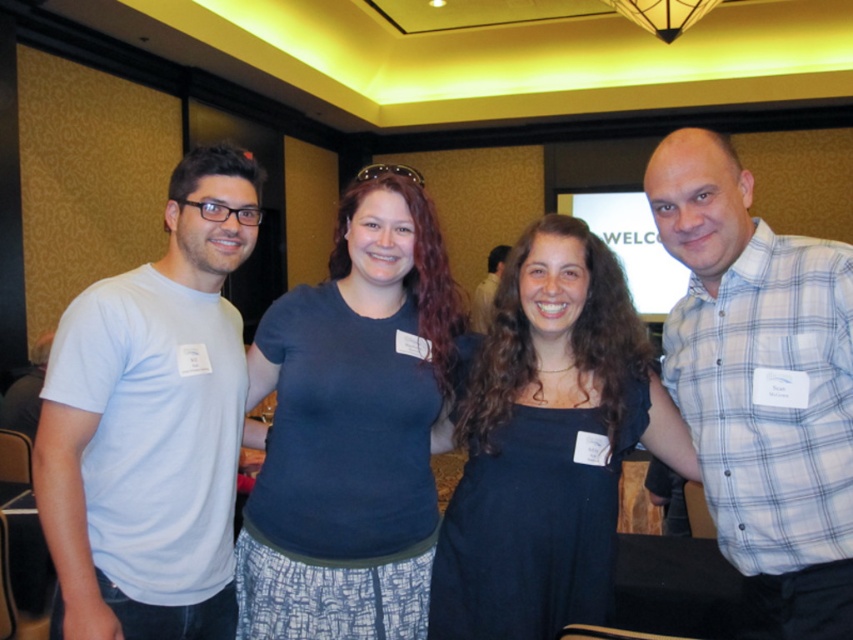
Who is more forward, (x=57, y=464) or (x=505, y=248)?

Point (x=57, y=464)

Locate an element on the screen. white matte t-shirt at left is located at coordinates point(152,422).

Which is behind, point (216, 170) or point (335, 256)?

Point (335, 256)

Which is in front, point (119, 365) or point (306, 470)?

Positioned in front is point (119, 365).

Between point (149, 352) and point (418, 234), which one is positioned in front?

Point (149, 352)

This screenshot has height=640, width=853. In order to click on white matte t-shirt at left in this screenshot , I will do `click(152, 422)`.

Can you confirm if black dress at center is positioned to the right of matte white shirt at center?

Incorrect, black dress at center is not on the right side of matte white shirt at center.

Is point (654, 436) closer to camera compared to point (485, 285)?

Yes, it is.

Locate an element on the screen. The height and width of the screenshot is (640, 853). black dress at center is located at coordinates (548, 444).